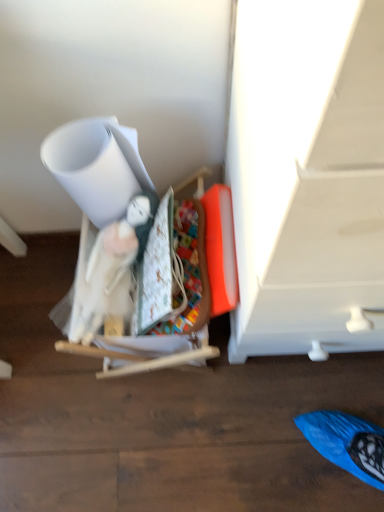
Where is `free region on the left part of white fabric doll at left`? The image size is (384, 512). free region on the left part of white fabric doll at left is located at coordinates (40, 336).